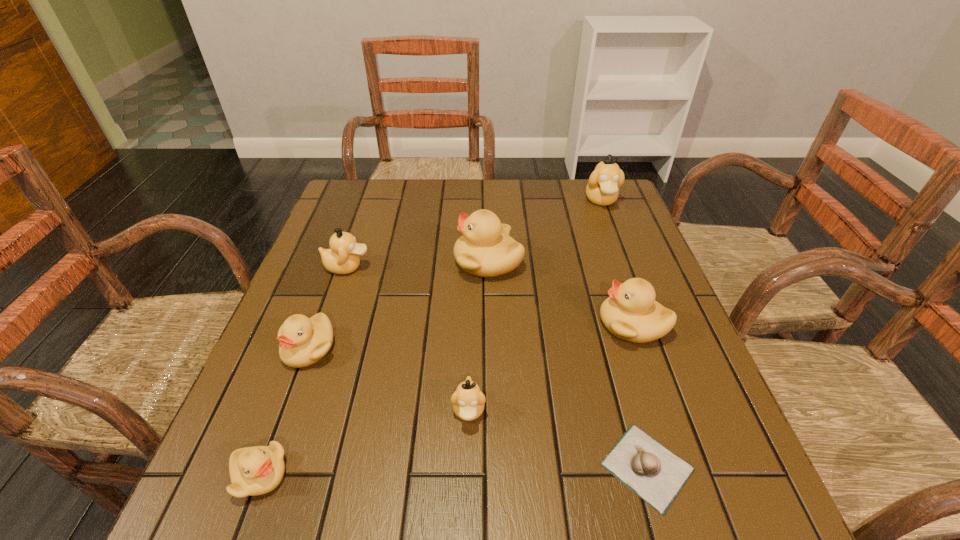
At what (x,y) coordinates should I click in order to perform the action: click on the nearest yellow duckling. Please return your answer as a coordinate pair (x, y). This screenshot has height=540, width=960. Looking at the image, I should click on (257, 470).

Find the location of `the smallest yellow duckling`. the smallest yellow duckling is located at coordinates (257, 470).

Locate an element on the screen. The width and height of the screenshot is (960, 540). garlic is located at coordinates (653, 472).

You are a GUI agent. You are given a task and a screenshot of the screen. Output one action in this format:
    pyautogui.click(x=<x>, y=<y>)
    Task: Click on the free space located on the face of the farthest object
    
    Given the screenshot: What is the action you would take?
    pyautogui.click(x=627, y=269)

The height and width of the screenshot is (540, 960). Find the location of `free space located on the beak of the third yellow duckling from left to right`. free space located on the beak of the third yellow duckling from left to right is located at coordinates (423, 261).

Where is `vacant area located 0.050m on the beak of the third yellow duckling from left to right`? The height and width of the screenshot is (540, 960). vacant area located 0.050m on the beak of the third yellow duckling from left to right is located at coordinates (435, 261).

This screenshot has width=960, height=540. In order to click on vacant space located on the beak of the third yellow duckling from left to right in this screenshot , I will do `click(334, 261)`.

Identify the location of vacant space located 0.240m on the beak of the rightmost yellow duckling. (492, 324).

This screenshot has width=960, height=540. I want to click on free space located on the beak of the rightmost yellow duckling, so click(x=455, y=324).

Find the location of `vacant space situated on the beak of the rightmost yellow duckling`. vacant space situated on the beak of the rightmost yellow duckling is located at coordinates (473, 324).